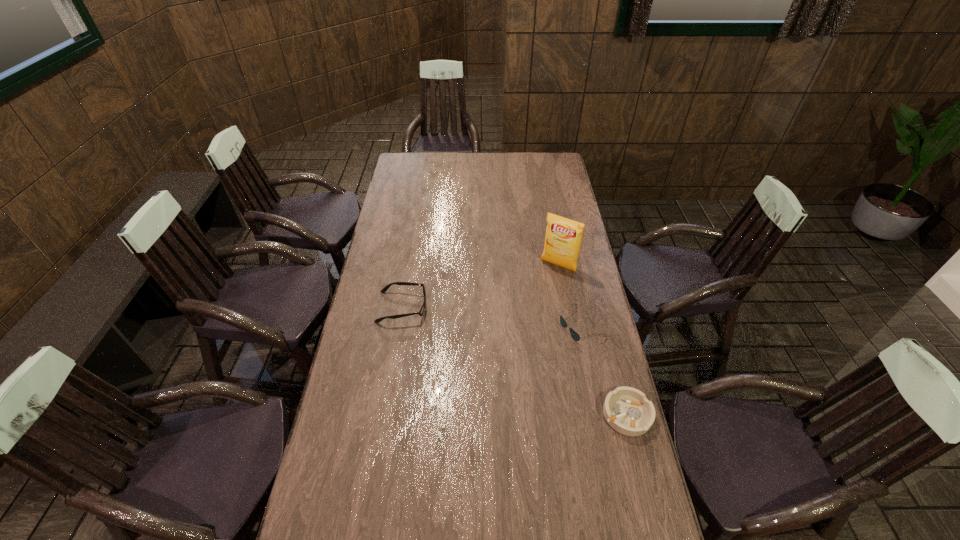
Where is `vacant space that's between the sunglasses and the leftmost object`? This screenshot has width=960, height=540. vacant space that's between the sunglasses and the leftmost object is located at coordinates (492, 316).

Image resolution: width=960 pixels, height=540 pixels. Find the location of `vacant point located between the nearest object and the sunglasses`. vacant point located between the nearest object and the sunglasses is located at coordinates (604, 369).

Point out which object is positioned as the third nearest to the sunglasses. Please provide its 2D coordinates. Your answer should be formatted as a tuple, i.e. [(x, y)], where the tuple contains the x and y coordinates of a point satisfying the conditions above.

[(385, 288)]

I want to click on object that stands as the second closest to the spectacles, so (575, 335).

Where is `free space that satisfies the following two spatial constraints: 1. on the front side of the sunglasses; 2. on the right side of the farthest object`? free space that satisfies the following two spatial constraints: 1. on the front side of the sunglasses; 2. on the right side of the farthest object is located at coordinates (569, 325).